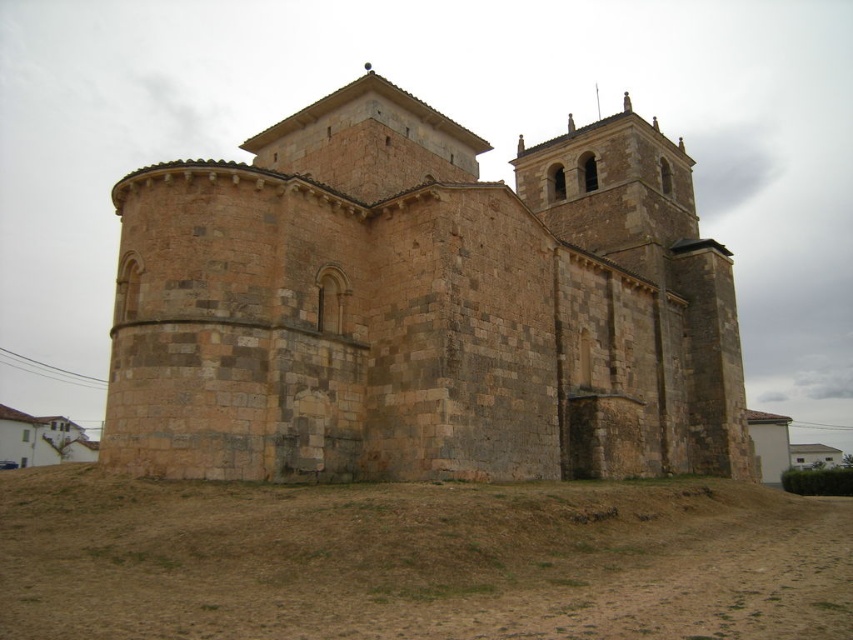
Question: Can you confirm if brown stone church at center is positioned above brown sandy dirt field at lower center?

Choices:
 (A) yes
 (B) no

Answer: (A)

Question: Where is brown stone church at center located in relation to brown sandy dirt field at lower center in the image?

Choices:
 (A) above
 (B) below

Answer: (A)

Question: Which point appears farthest from the camera in this image?

Choices:
 (A) (613, 493)
 (B) (473, 410)

Answer: (B)

Question: Can you confirm if brown stone church at center is positioned to the right of brown sandy dirt field at lower center?

Choices:
 (A) no
 (B) yes

Answer: (B)

Question: Among these points, which one is farthest from the camera?

Choices:
 (A) (373, 180)
 (B) (566, 605)

Answer: (A)